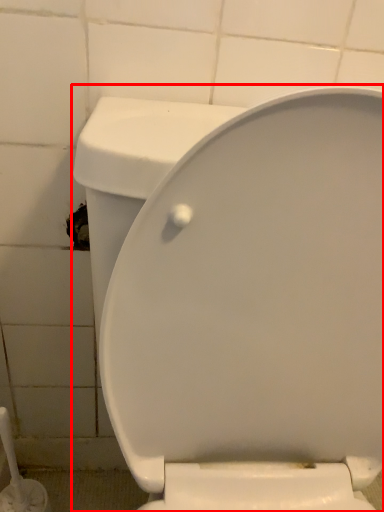
Question: From the image, what is the correct spatial relationship of toilet (annotated by the red box) in relation to brush?

Choices:
 (A) right
 (B) left

Answer: (A)